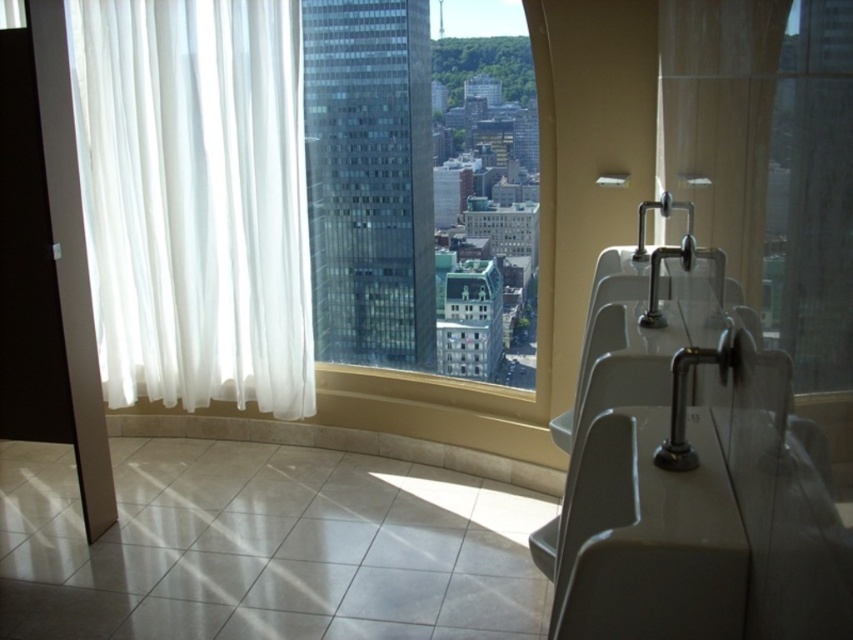
Looking at this image, you are designing a new restroom and want to ensure there is enough space for both the white sheer curtain at left and the transparent glass window at center. Based on the scene, which object takes up more space?

The transparent glass window at center takes up more space than the white sheer curtain at left, as the white sheer curtain at left occupies less space according to the description.